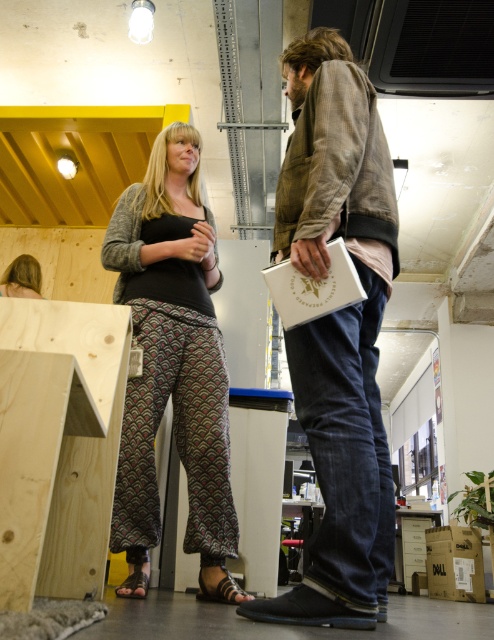
Looking at this image, you are standing at the point with coordinates point (37,285) and want to move to the door located at point (203,440). Can you walk directly to the door without moving around any obstacles?

Point (203,440) is in front of point (37,285), so yes, you can walk directly to the door located at point (203,440) without moving around any obstacles since it is in front of your current position.

You are standing in the office and need to locate the denim jacket at center and the patterned fabric pants at center. According to the scene, which object is positioned to the right side?

The denim jacket at center is to the right of the patterned fabric pants at center, so the denim jacket at center is positioned to the right side.

You are designing a layout for a small closet. You have two items to place inside the closet, the denim jacket at center and the patterned fabric pants at center. Which item should you place first in the closet to maximize space efficiency?

The denim jacket at center has a lesser width compared to the patterned fabric pants at center, so you should place the patterned fabric pants at center first to maximize space efficiency.